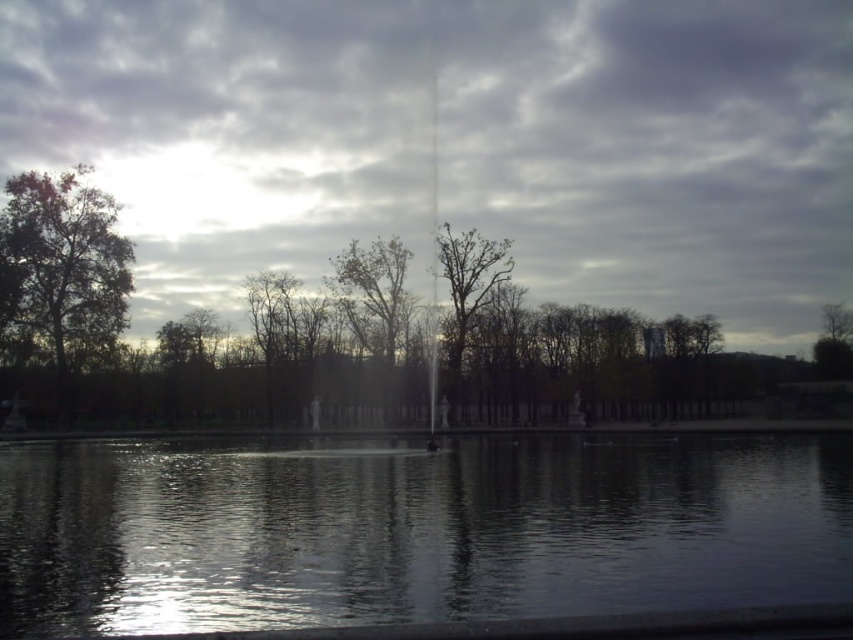
You are standing in the middle of the pond looking towards the edge. Which object, the gray cloudy sky at upper center or the green leafy tree at left, would appear bigger to you?

The gray cloudy sky at upper center is larger in size than the green leafy tree at left, so it would appear bigger.

You are a drone operator who needs to fly a drone between the gray cloudy sky at upper center and the water surface below. The drone has a maximum flight distance of 70 meters. Can the drone safely complete the flight without exceeding its range?

The distance between the gray cloudy sky at upper center and the water surface is 69.99 meters, which is within the drone operator s 70 meters maximum flight range. Therefore, the drone can safely complete the flight without exceeding its range.

You are an architect designing a new garden and want to ensure the fountain at the center of the garden is visible from the sky. Given the gray cloudy sky at upper center and transparent water at center, which object would block the view of the fountain from the sky?

The transparent water at center would block the view of the fountain from the gray cloudy sky at upper center because the sky is larger and might cast shadows over the water, but since the water is transparent, it might reflect the sky, making the fountain less visible.